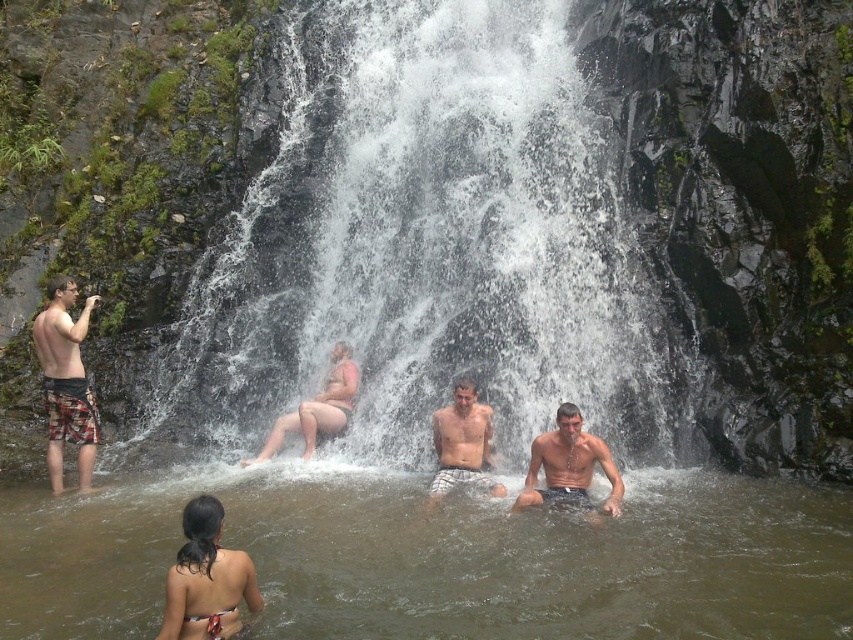
Identify the location of white frothy water at center. The height and width of the screenshot is (640, 853). (422, 248).

Does point (196, 582) come in front of point (322, 435)?

Yes, it is.

Can you confirm if multicolored bikini at lower left is smaller than smooth tan skin at center?

Incorrect, multicolored bikini at lower left is not smaller in size than smooth tan skin at center.

Where is `multicolored bikini at lower left`? multicolored bikini at lower left is located at coordinates (206, 579).

Find the location of `multicolored bikini at lower left`. multicolored bikini at lower left is located at coordinates (206, 579).

Based on the photo, who is higher up, plaid shorts at left or shiny wet skin at center?

plaid shorts at left

Is plaid shorts at left closer to the viewer compared to shiny wet skin at center?

That is False.

Between point (85, 380) and point (576, 481), which one is positioned in front?

Point (576, 481) is in front.

This screenshot has height=640, width=853. What are the coordinates of `plaid shorts at left` in the screenshot? It's located at (65, 381).